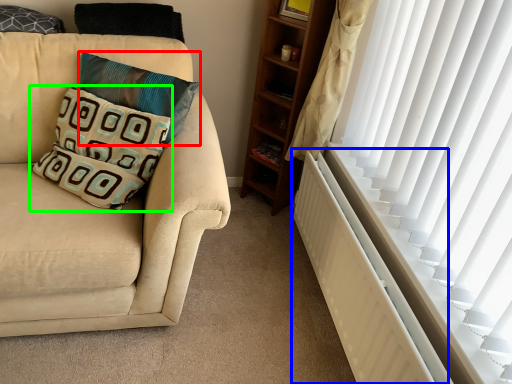
Question: Which is nearer to the pillow (highlighted by a red box)? radiator (highlighted by a blue box) or pillow (highlighted by a green box).

Choices:
 (A) radiator
 (B) pillow

Answer: (B)